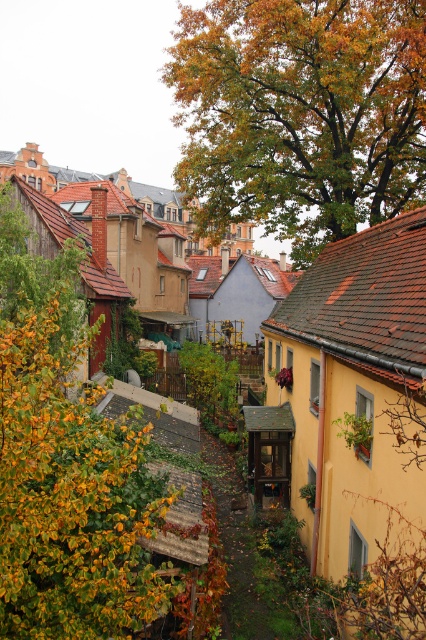
Question: Which of the following is the farthest from the observer?

Choices:
 (A) green leafy tree at upper center
 (B) green leafy tree at left

Answer: (A)

Question: Considering the relative positions of green leafy tree at upper center and green leafy tree at left in the image provided, where is green leafy tree at upper center located with respect to green leafy tree at left?

Choices:
 (A) left
 (B) right

Answer: (B)

Question: Considering the relative positions of green leafy tree at upper center and green leafy tree at left in the image provided, where is green leafy tree at upper center located with respect to green leafy tree at left?

Choices:
 (A) left
 (B) right

Answer: (B)

Question: Which of the following is the farthest from the observer?

Choices:
 (A) green leafy tree at left
 (B) green leafy tree at upper center

Answer: (B)

Question: Is green leafy tree at upper center wider than green leafy tree at left?

Choices:
 (A) yes
 (B) no

Answer: (A)